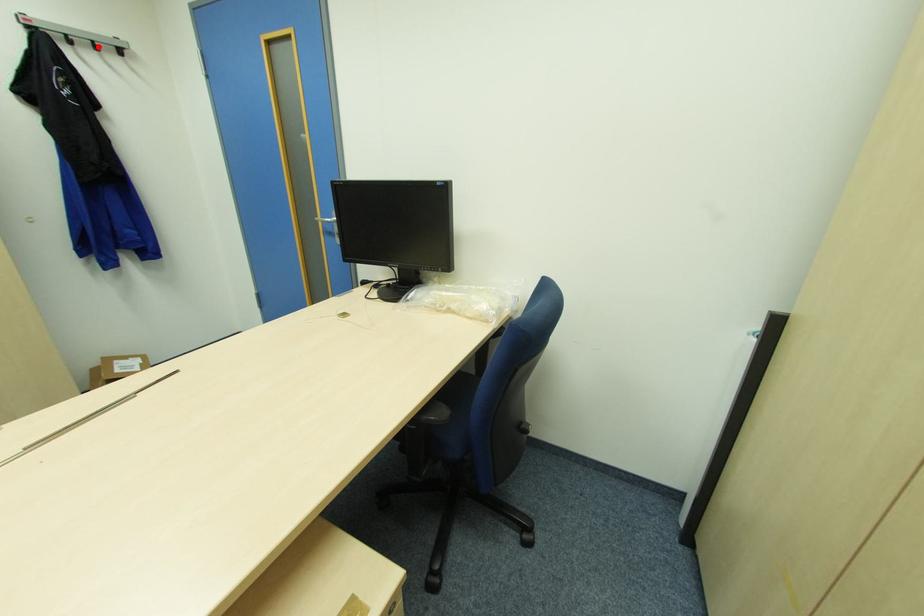
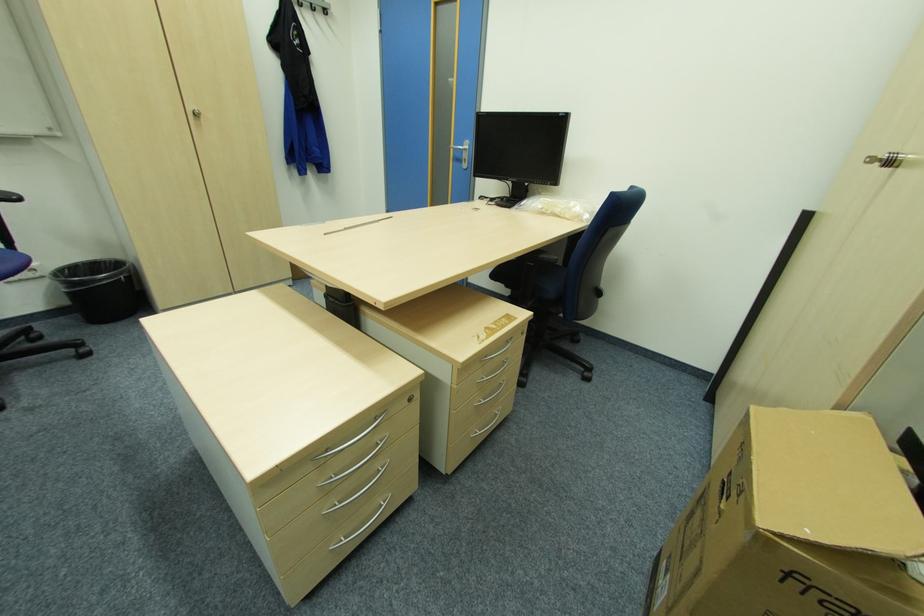
The point at the highlighted location is marked in the first image. Where is the corresponding point in the second image?

(315, 7)